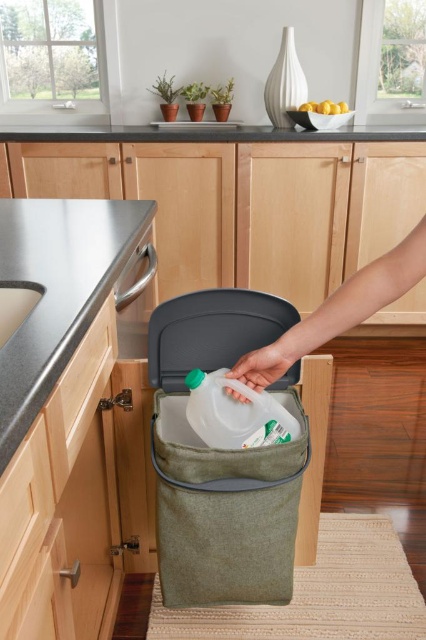
From the picture: You are a kitchen designer planning to place a new appliance that requires 18 inches of space between it and the translucent plastic bottle at center. Can the stainless steel countertop at upper left provide enough space for this requirement?

The stainless steel countertop at upper left and the translucent plastic bottle at center are 16.79 inches apart from each other, which is less than the required 18 inches. Therefore, the space provided by the stainless steel countertop at upper left is insufficient for the appliance placement requirement.

You are a chef preparing to place a new ingredient on the stainless steel countertop at upper left and the translucent plastic bottle at center. Which surface is closer to you?

The stainless steel countertop at upper left is closer to the viewer than the translucent plastic bottle at center.

You need to place a new spice jar that is as wide as the translucent plastic bottle at center on the satin steel countertop at upper center. Will it fit in terms of width?

The satin steel countertop at upper center is wider than the translucent plastic bottle at center, so the spice jar will fit in terms of width.